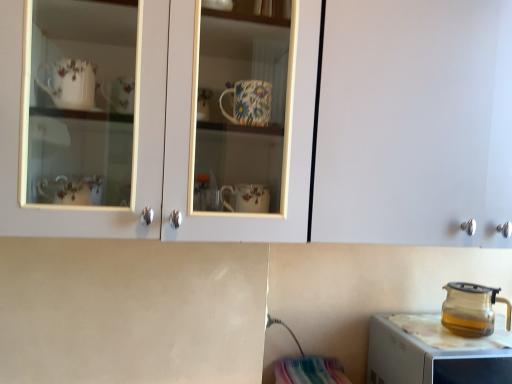
I want to click on free location above transparent glass kettle at lower right (from a real-world perspective), so click(463, 336).